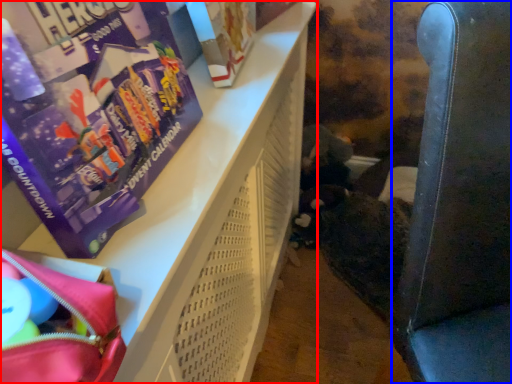
Question: Which of the following is the closest to the observer, furniture (highlighted by a red box) or armchair (highlighted by a blue box)?

Choices:
 (A) furniture
 (B) armchair

Answer: (B)